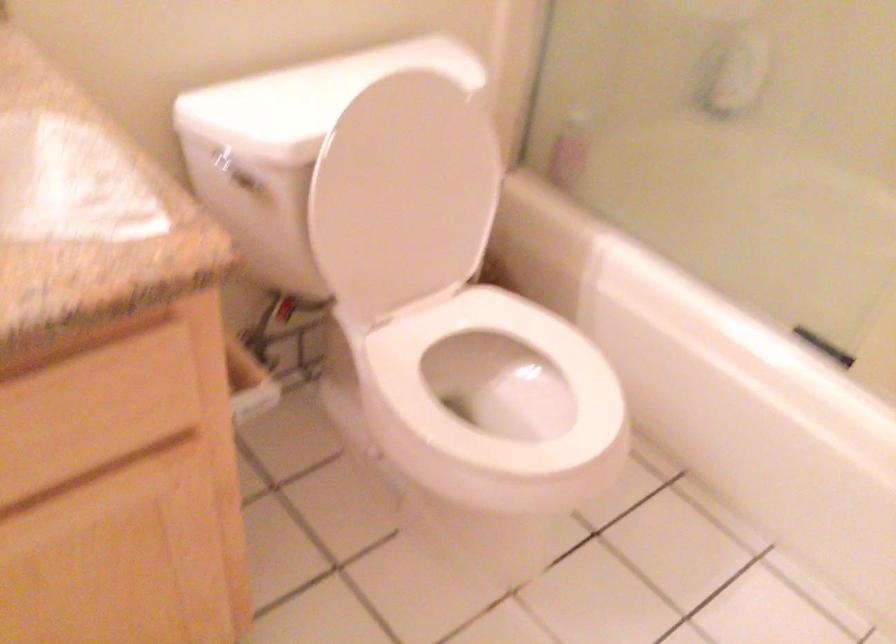
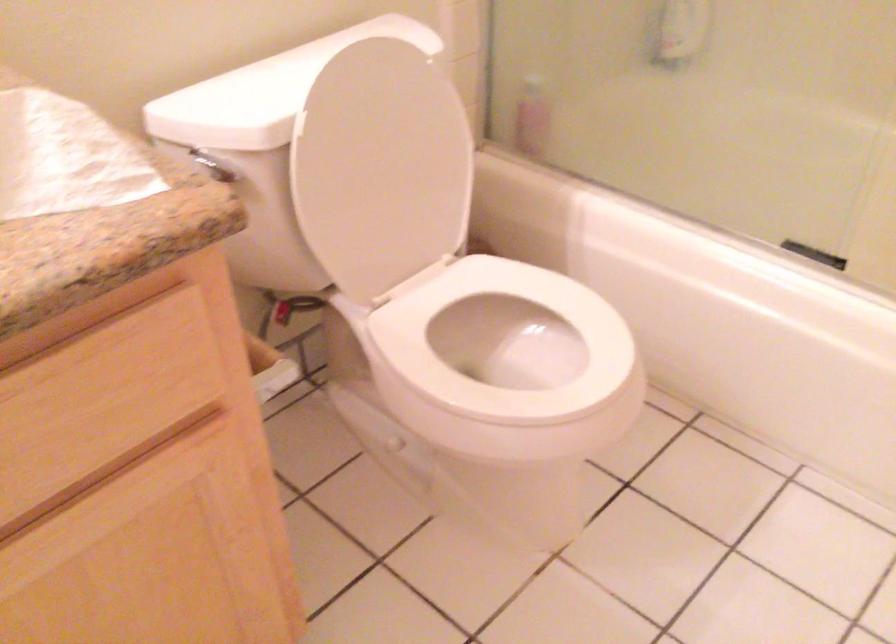
Locate, in the second image, the point that corresponds to [130,459] in the first image.

(164, 440)